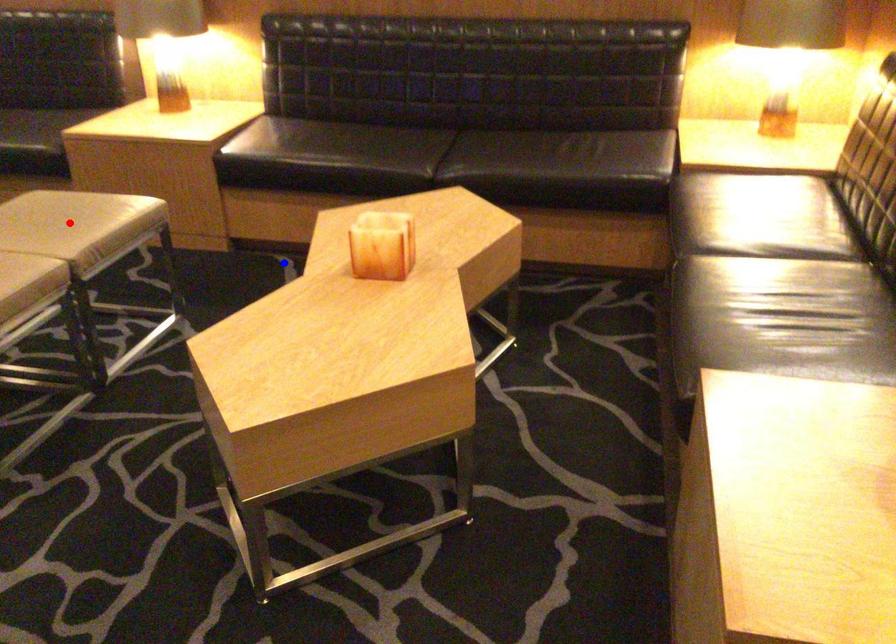
Question: Which of the two points in the image is closer to the camera?

Choices:
 (A) Blue point is closer.
 (B) Red point is closer.

Answer: (B)